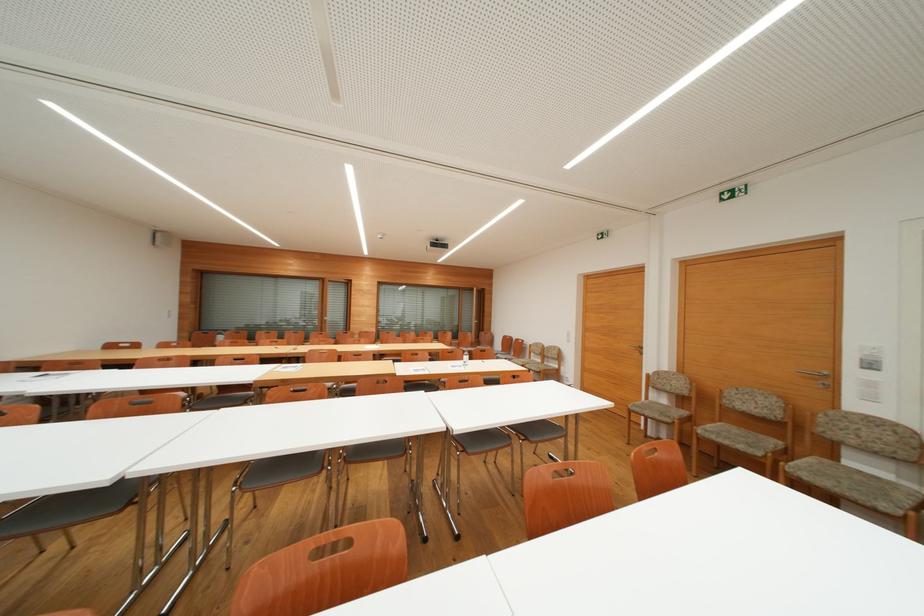
I want to click on small white bottle, so click(x=465, y=357).